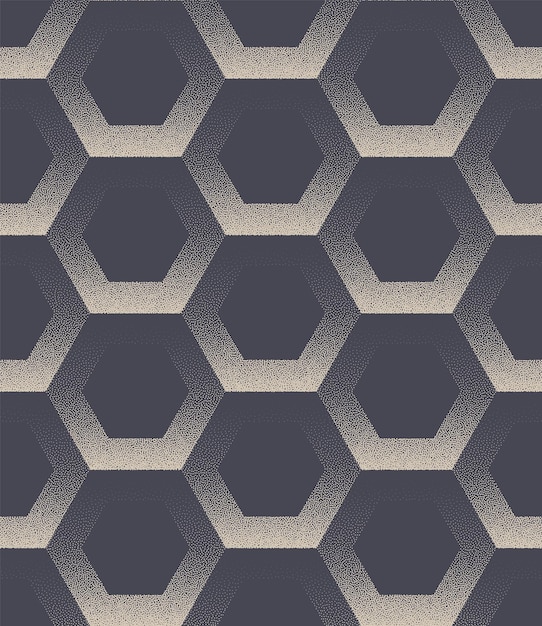
The width and height of the screenshot is (542, 626). In order to click on wallpaper background in this screenshot , I will do `click(266, 308)`.